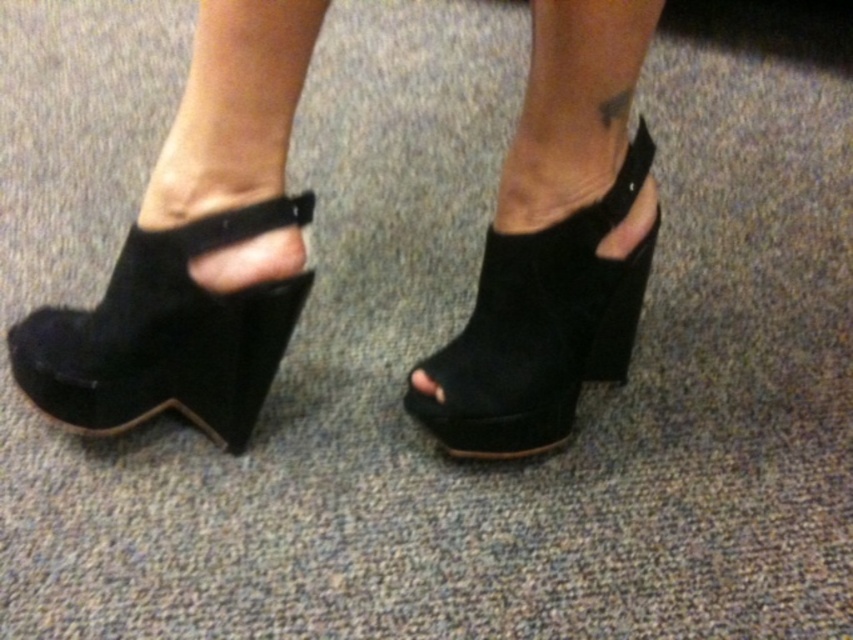
Between point (279, 166) and point (569, 296), which one is positioned behind?

Positioned behind is point (569, 296).

Is suede wedge shoes at center smaller than suede black wedge at center?

Incorrect, suede wedge shoes at center is not smaller in size than suede black wedge at center.

Who is more distant from viewer, (599, 172) or (595, 241)?

The point (595, 241) is more distant.

Locate an element on the screen. This screenshot has width=853, height=640. suede wedge shoes at center is located at coordinates (194, 250).

Between suede black wedge at left and black suede toe at center, which one is positioned lower?

Positioned lower is black suede toe at center.

Can you confirm if suede black wedge at left is positioned to the left of black suede toe at center?

Yes, suede black wedge at left is to the left of black suede toe at center.

Find the location of a particular element. Image resolution: width=853 pixels, height=640 pixels. suede black wedge at left is located at coordinates (166, 333).

Is suede wedge shoes at center wider than suede black wedge at left?

Correct, the width of suede wedge shoes at center exceeds that of suede black wedge at left.

Can you confirm if suede wedge shoes at center is bigger than suede black wedge at left?

Yes.

I want to click on suede wedge shoes at center, so click(x=194, y=250).